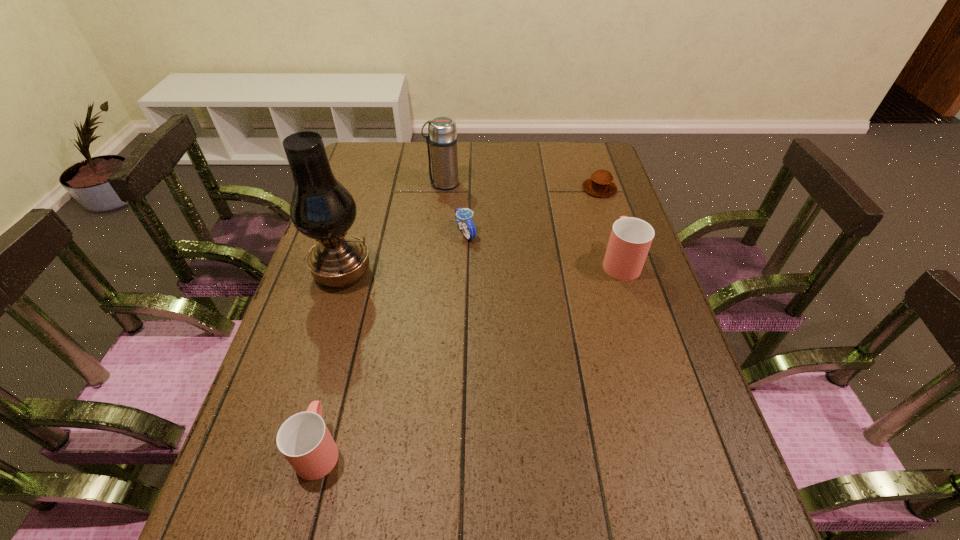
In the image, there is a desktop. Where is `vacant space at the far left corner`? vacant space at the far left corner is located at coordinates point(401,142).

The image size is (960, 540). Find the location of `vacant space at the far right corner of the desktop`. vacant space at the far right corner of the desktop is located at coordinates (606, 154).

The height and width of the screenshot is (540, 960). I want to click on free space between the muffin and the second tallest object, so click(x=521, y=186).

Where is `vacant space in between the second tallest object and the watch`? The height and width of the screenshot is (540, 960). vacant space in between the second tallest object and the watch is located at coordinates (454, 208).

This screenshot has height=540, width=960. What are the coordinates of `vacant space in between the watch and the muffin` in the screenshot? It's located at (533, 211).

I want to click on vacant space that's between the thermos bottle and the nearest object, so click(x=381, y=316).

Identify the location of free spot between the farther cup and the nearest object. (469, 355).

This screenshot has height=540, width=960. Identify the location of free space between the taller cup and the watch. (542, 247).

At what (x,y) coordinates should I click in order to perform the action: click on free area in between the nearer cup and the tallest object. Please return your answer as a coordinate pair (x, y). Image resolution: width=960 pixels, height=540 pixels. Looking at the image, I should click on (331, 361).

Locate an element on the screen. This screenshot has height=540, width=960. vacant space that's between the farther cup and the shorter cup is located at coordinates (469, 355).